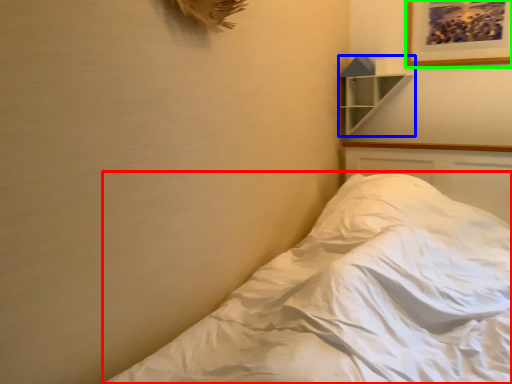
Question: Which is nearer to the bed (highlighted by a red box)? shelf (highlighted by a blue box) or picture frame (highlighted by a green box).

Choices:
 (A) shelf
 (B) picture frame

Answer: (A)